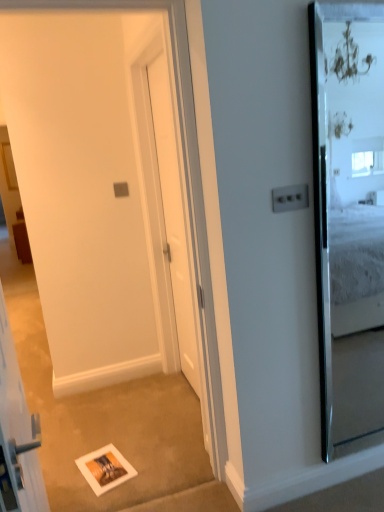
Question: Is white glossy picture frame at lower center inside white glossy elevator at lower left?

Choices:
 (A) yes
 (B) no

Answer: (B)

Question: Is white glossy elevator at lower left bigger than white glossy picture frame at lower center?

Choices:
 (A) yes
 (B) no

Answer: (A)

Question: Considering the relative sizes of white glossy elevator at lower left and white glossy picture frame at lower center in the image provided, is white glossy elevator at lower left thinner than white glossy picture frame at lower center?

Choices:
 (A) yes
 (B) no

Answer: (A)

Question: Is white glossy elevator at lower left positioned in front of white glossy picture frame at lower center?

Choices:
 (A) no
 (B) yes

Answer: (B)

Question: From the image's perspective, is white glossy elevator at lower left located above white glossy picture frame at lower center?

Choices:
 (A) yes
 (B) no

Answer: (A)

Question: Do you think white glossy door at center is within white matte barn door at center, or outside of it?

Choices:
 (A) outside
 (B) inside

Answer: (A)

Question: From a real-world perspective, is white glossy door at center physically located above or below white matte barn door at center?

Choices:
 (A) above
 (B) below

Answer: (A)

Question: In terms of height, does white glossy door at center look taller or shorter compared to white matte barn door at center?

Choices:
 (A) short
 (B) tall

Answer: (A)

Question: Considering the relative positions of white glossy door at center and white matte barn door at center in the image provided, is white glossy door at center to the left or to the right of white matte barn door at center?

Choices:
 (A) left
 (B) right

Answer: (B)

Question: Considering the positions of white glossy picture frame at lower center and white glossy door at center in the image, is white glossy picture frame at lower center wider or thinner than white glossy door at center?

Choices:
 (A) wide
 (B) thin

Answer: (A)

Question: Do you think white glossy picture frame at lower center is within white glossy door at center, or outside of it?

Choices:
 (A) inside
 (B) outside

Answer: (B)

Question: In terms of height, does white glossy picture frame at lower center look taller or shorter compared to white glossy door at center?

Choices:
 (A) short
 (B) tall

Answer: (A)

Question: Does point (117, 482) appear closer or farther from the camera than point (155, 131)?

Choices:
 (A) closer
 (B) farther

Answer: (A)

Question: In terms of width, does white glossy elevator at lower left look wider or thinner when compared to clear glass mirror at right?

Choices:
 (A) wide
 (B) thin

Answer: (A)

Question: From the image's perspective, is white glossy elevator at lower left above or below clear glass mirror at right?

Choices:
 (A) below
 (B) above

Answer: (A)